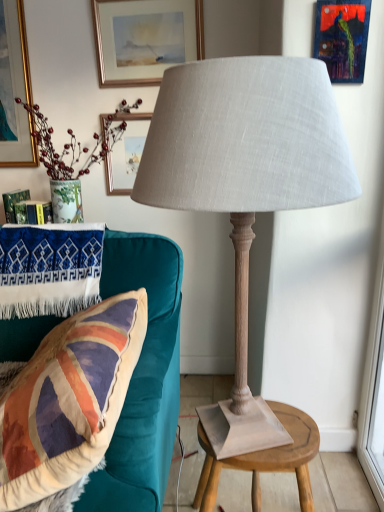
Locate an element on the screen. The width and height of the screenshot is (384, 512). empty space that is ontop of wooden stool at center (from a real-world perspective) is located at coordinates (270, 437).